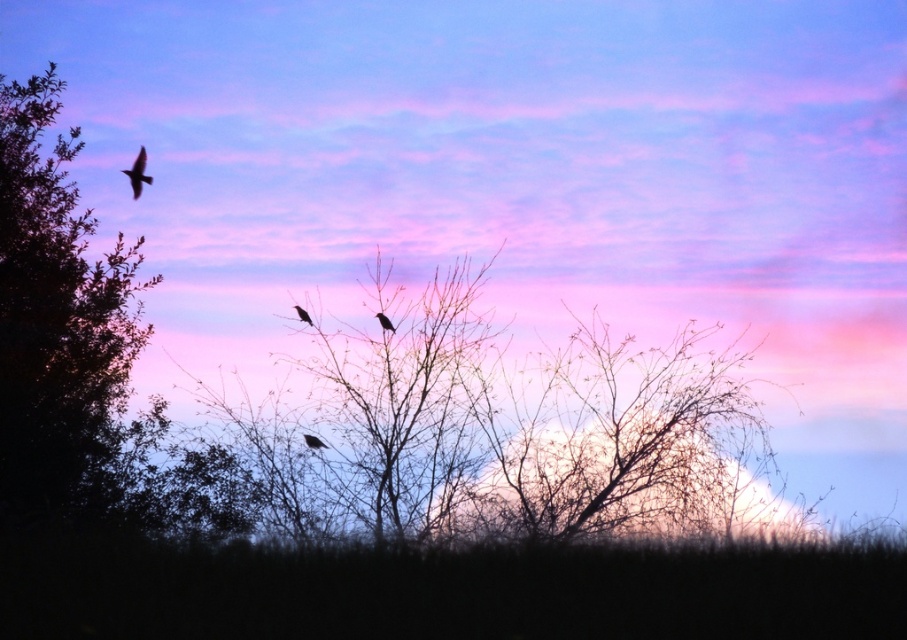
Who is positioned more to the right, white fluffy cloud at center or silhouette bare branches at center?

white fluffy cloud at center is more to the right.

Based on the photo, does white fluffy cloud at center have a lesser height compared to silhouette bare branches at center?

Yes, white fluffy cloud at center is shorter than silhouette bare branches at center.

Does point (587, 525) come in front of point (395, 365)?

Yes, point (587, 525) is in front of point (395, 365).

Where is `white fluffy cloud at center`? This screenshot has width=907, height=640. white fluffy cloud at center is located at coordinates (622, 477).

Can you confirm if silhouette bare branches at center is shorter than matte black bird at center?

Incorrect, silhouette bare branches at center's height does not fall short of matte black bird at center's.

Who is lower down, silhouette bare branches at center or matte black bird at center?

silhouette bare branches at center is below.

This screenshot has width=907, height=640. What are the coordinates of `silhouette bare branches at center` in the screenshot? It's located at (405, 404).

Is point (54, 332) farther from camera compared to point (320, 445)?

No, it is in front of (320, 445).

Between dark green leafy tree at left and silhouette feathered bird at center, which one appears on the right side from the viewer's perspective?

From the viewer's perspective, silhouette feathered bird at center appears more on the right side.

Where is `dark green leafy tree at left`? The width and height of the screenshot is (907, 640). dark green leafy tree at left is located at coordinates (54, 312).

You are a GUI agent. You are given a task and a screenshot of the screen. Output one action in this format:
    pyautogui.click(x=<x>, y=<y>)
    Task: Click on the dark green leafy tree at left
    The height and width of the screenshot is (640, 907).
    Given the screenshot: What is the action you would take?
    pyautogui.click(x=54, y=312)